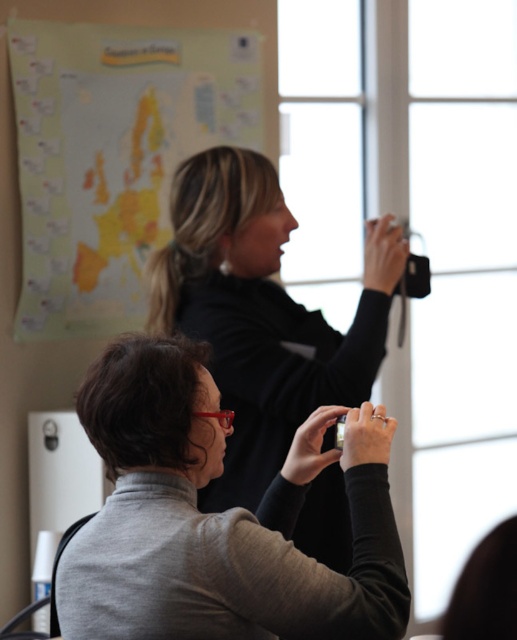
Question: Is gray matte turtleneck at lower left to the right of black matte camera at upper center from the viewer's perspective?

Choices:
 (A) yes
 (B) no

Answer: (B)

Question: Observing the image, what is the correct spatial positioning of gray matte turtleneck at lower left in reference to yellow matte map at upper left?

Choices:
 (A) right
 (B) left

Answer: (A)

Question: Which of the following is the farthest from the observer?

Choices:
 (A) yellow matte map at upper left
 (B) gray matte turtleneck at lower left

Answer: (A)

Question: Can you confirm if gray matte turtleneck at lower left is positioned below yellow matte map at upper left?

Choices:
 (A) no
 (B) yes

Answer: (B)

Question: Which object is farther from the camera taking this photo?

Choices:
 (A) black matte camera at upper center
 (B) yellow matte map at upper left

Answer: (B)

Question: Which object appears closest to the camera in this image?

Choices:
 (A) gray matte turtleneck at lower left
 (B) yellow matte map at upper left

Answer: (A)